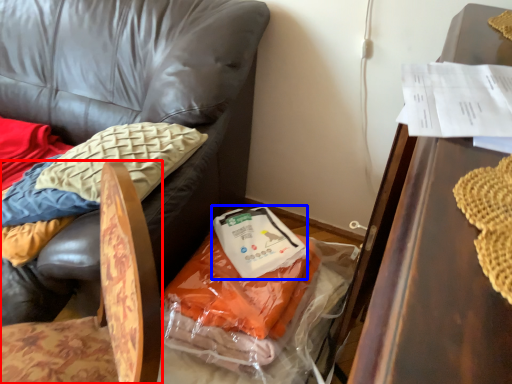
Question: Which of the following is the closest to the observer, chair (highlighted by a red box) or food (highlighted by a blue box)?

Choices:
 (A) chair
 (B) food

Answer: (A)